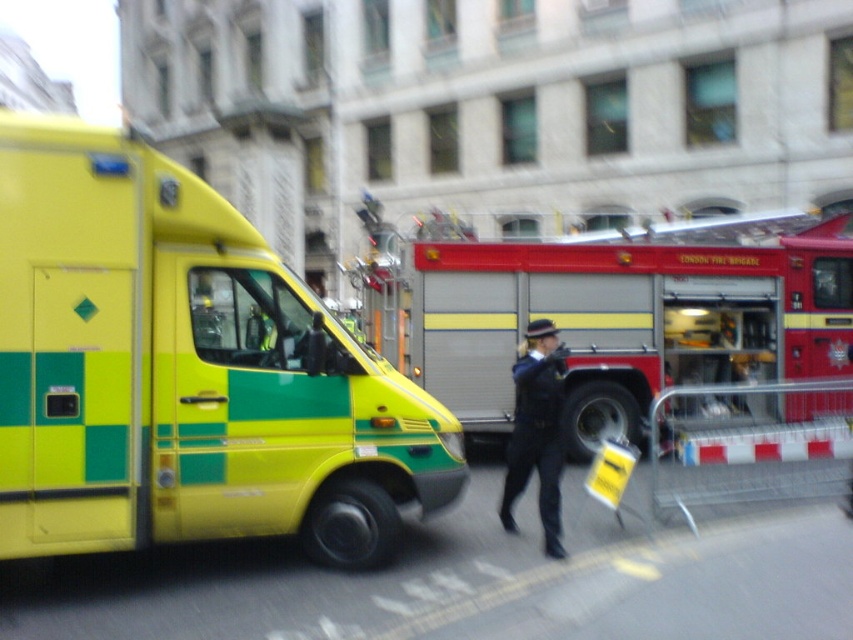
Is point (405, 273) closer to camera compared to point (506, 502)?

No, it is behind (506, 502).

Can you confirm if red metallic fire truck at center is positioned to the right of dark blue uniform at center?

Correct, you'll find red metallic fire truck at center to the right of dark blue uniform at center.

This screenshot has width=853, height=640. What do you see at coordinates (608, 312) in the screenshot? I see `red metallic fire truck at center` at bounding box center [608, 312].

Find the location of a particular element. This screenshot has height=640, width=853. red metallic fire truck at center is located at coordinates (608, 312).

Looking at this image, which of these two, yellow/green checkered ambulance at left or red metallic fire truck at center, stands taller?

With more height is red metallic fire truck at center.

The width and height of the screenshot is (853, 640). Describe the element at coordinates (184, 371) in the screenshot. I see `yellow/green checkered ambulance at left` at that location.

Locate an element on the screen. The image size is (853, 640). yellow/green checkered ambulance at left is located at coordinates (184, 371).

The height and width of the screenshot is (640, 853). Identify the location of yellow/green checkered ambulance at left. (184, 371).

You are a GUI agent. You are given a task and a screenshot of the screen. Output one action in this format:
    pyautogui.click(x=<x>, y=<y>)
    Task: Click on the yellow/green checkered ambulance at left
    The image size is (853, 640).
    Given the screenshot: What is the action you would take?
    pyautogui.click(x=184, y=371)

Does point (427, 449) come behind point (521, 468)?

No, it is in front of (521, 468).

What do you see at coordinates (184, 371) in the screenshot?
I see `yellow/green checkered ambulance at left` at bounding box center [184, 371].

This screenshot has height=640, width=853. Find the location of `yellow/green checkered ambulance at left`. yellow/green checkered ambulance at left is located at coordinates (184, 371).